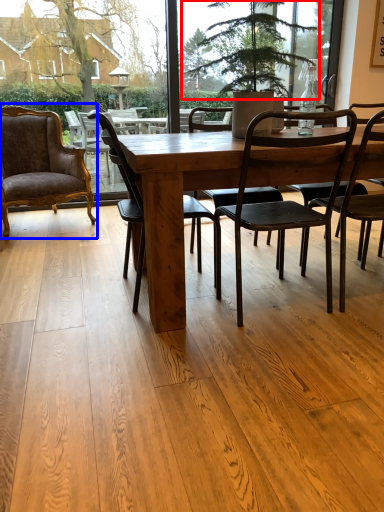
Question: Which object is closer to the camera taking this photo, tree (highlighted by a red box) or chair (highlighted by a blue box)?

Choices:
 (A) tree
 (B) chair

Answer: (A)